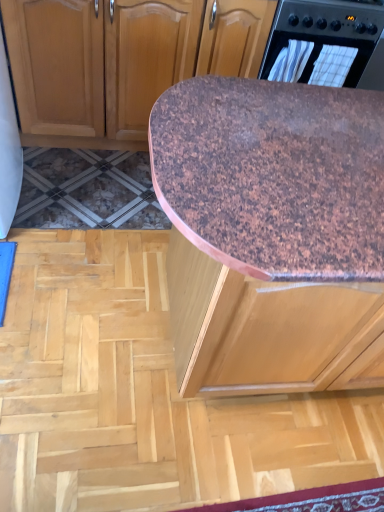
You are a GUI agent. You are given a task and a screenshot of the screen. Output one action in this format:
    pyautogui.click(x=<x>, y=<y>)
    Task: Click on the vacant space situated on the left part of brown speckled granite countertop at center
    Image resolution: width=384 pixels, height=512 pixels.
    Given the screenshot: What is the action you would take?
    pyautogui.click(x=82, y=276)